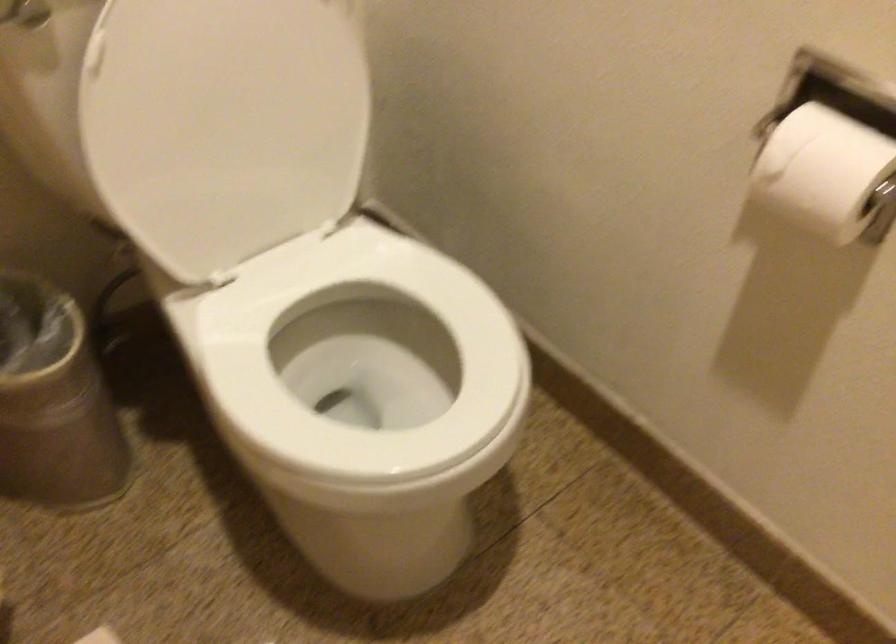
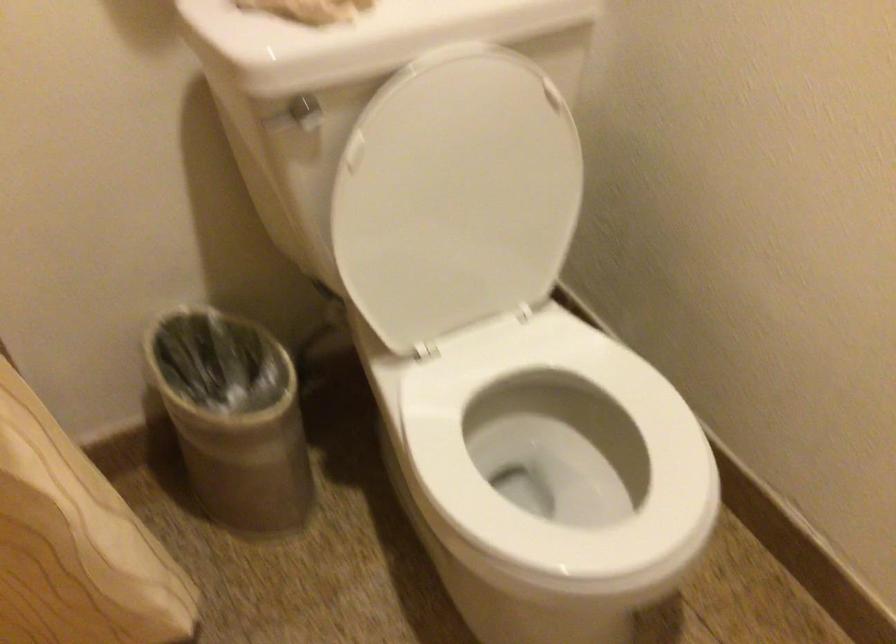
Question: The images are taken continuously from a first-person perspective. In which direction is your viewpoint rotating?

Choices:
 (A) Left
 (B) Right
 (C) Up
 (D) Down

Answer: (A)